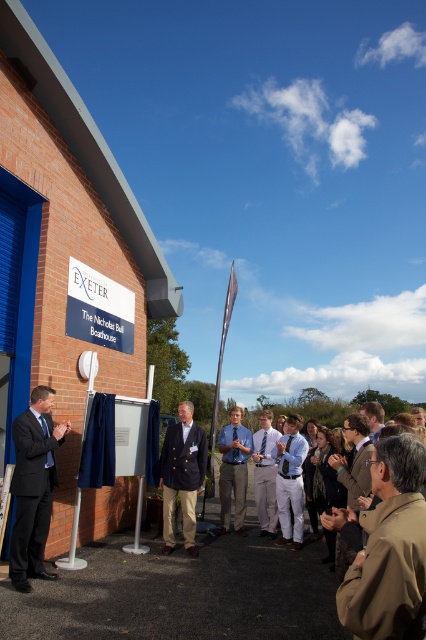
Question: Is brown leather jacket at lower right thinner than matte black suit at left?

Choices:
 (A) no
 (B) yes

Answer: (B)

Question: Does matte black suit at left come in front of navy blue blazer at center?

Choices:
 (A) yes
 (B) no

Answer: (A)

Question: Which of the following is the farthest from the observer?

Choices:
 (A) brown leather jacket at lower right
 (B) matte black suit at left

Answer: (B)

Question: Among these objects, which one is nearest to the camera?

Choices:
 (A) brown leather jacket at lower right
 (B) light brown leather jacket at center
 (C) light blue shirt at center
 (D) matte black suit at left

Answer: (A)

Question: Which of the following is the farthest from the observer?

Choices:
 (A) (379, 410)
 (B) (42, 525)
 (C) (408, 541)

Answer: (B)

Question: Where is brown leather jacket at lower right located in relation to blue cotton shirt at center in the image?

Choices:
 (A) above
 (B) below

Answer: (A)